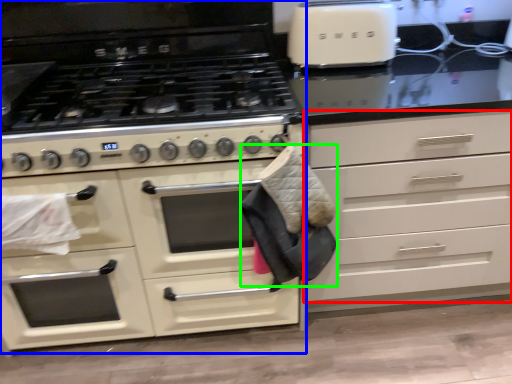
Question: Which object is positioned closest to drawer (highlighted by a red box)? Select from cabinetry (highlighted by a blue box) and material (highlighted by a green box).

Choices:
 (A) cabinetry
 (B) material

Answer: (B)